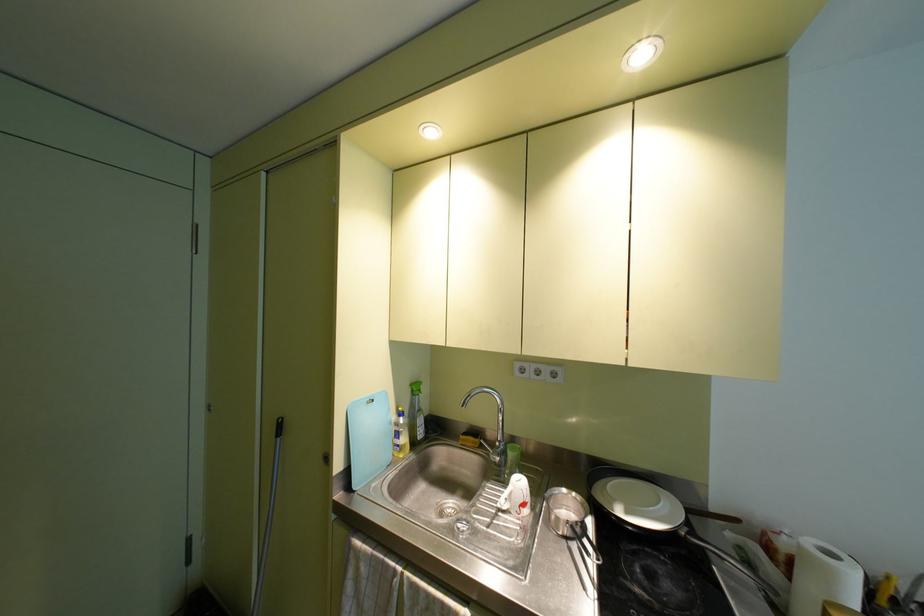
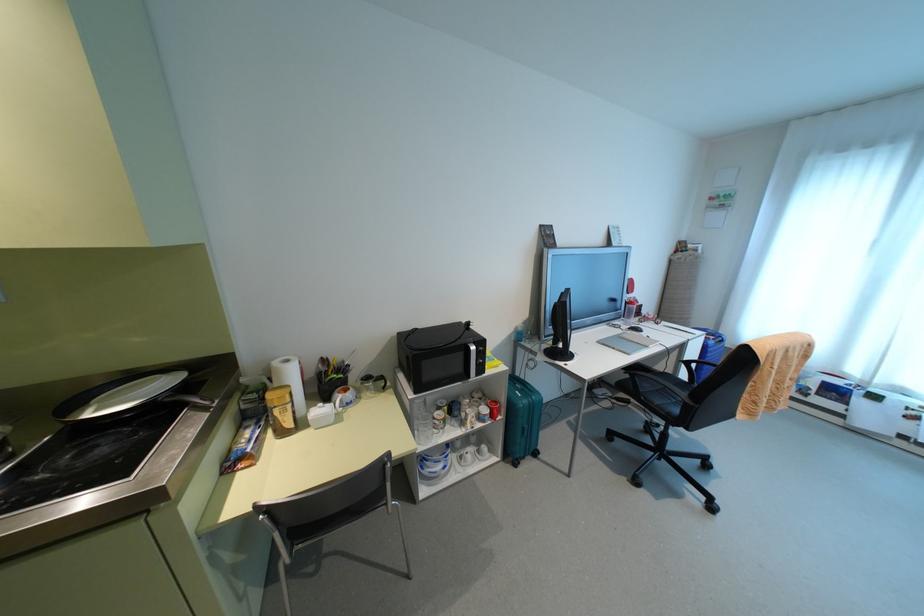
Find the pixel in the second image that matches point (832, 554) in the first image.

(286, 361)